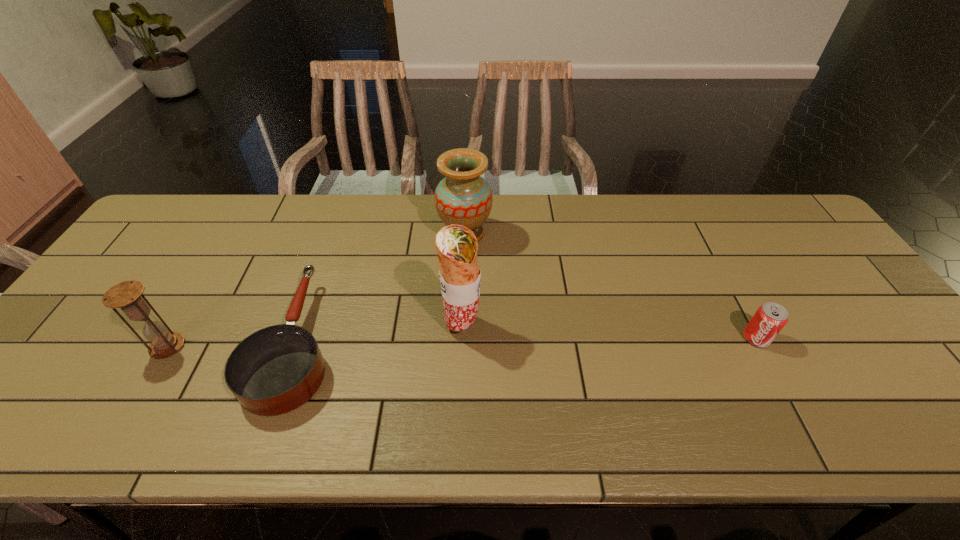
In order to click on burrito in this screenshot , I will do `click(460, 277)`.

Where is `vase`? The width and height of the screenshot is (960, 540). vase is located at coordinates (463, 197).

I want to click on the fourth shortest object, so click(463, 197).

I want to click on the third tallest object, so click(127, 295).

Find the location of a particular element. The image size is (960, 540). hourglass is located at coordinates (127, 295).

Identify the location of the rightmost object. (769, 319).

Find the location of `soda can`. soda can is located at coordinates [x=769, y=319].

Where is `pan`? The image size is (960, 540). pan is located at coordinates (275, 370).

Identify the location of the shortest object. (275, 370).

At what (x,y) coordinates should I click in order to perform the action: click on vacant space situated on the front of the burrito. Please return your answer as a coordinate pair (x, y). Looking at the image, I should click on coord(460,401).